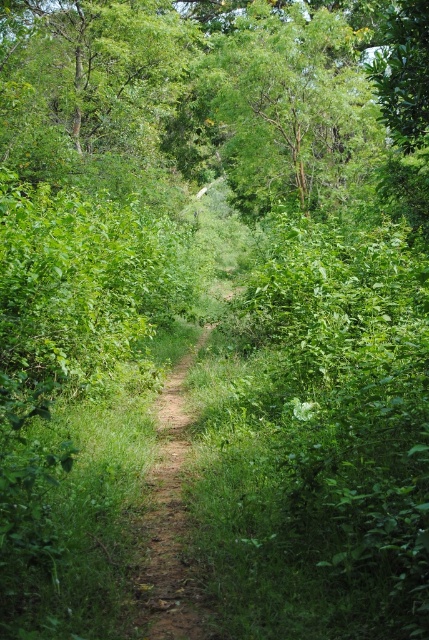
Question: Which point appears closest to the camera in this image?

Choices:
 (A) (154, 484)
 (B) (340, 141)

Answer: (A)

Question: Can you confirm if green leafy tree at upper center is positioned below dirt path at center?

Choices:
 (A) yes
 (B) no

Answer: (B)

Question: In this image, where is green leafy tree at upper center located relative to dirt path at center?

Choices:
 (A) below
 (B) above

Answer: (B)

Question: Can you confirm if green leafy tree at upper center is positioned to the right of dirt path at center?

Choices:
 (A) yes
 (B) no

Answer: (A)